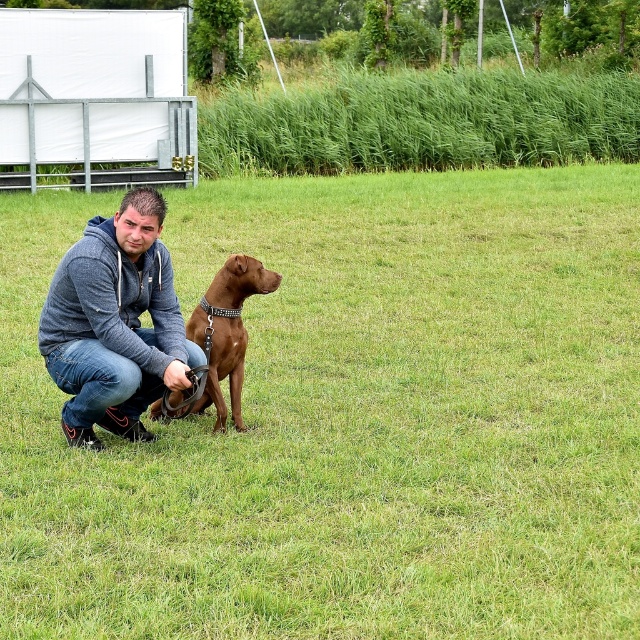
Is point (93, 401) more distant than point (83, 426)?

No, (93, 401) is closer to viewer.

What do you see at coordinates (115, 323) in the screenshot?
I see `gray hoodie at lower left` at bounding box center [115, 323].

At what (x,y) coordinates should I click in order to perform the action: click on gray hoodie at lower left. Please return your answer as a coordinate pair (x, y). Image resolution: width=640 pixels, height=640 pixels. Looking at the image, I should click on (115, 323).

Does brown leather dog at center appear under gray hoodie at lower left?

Incorrect, brown leather dog at center is not positioned below gray hoodie at lower left.

Locate an element on the screen. brown leather dog at center is located at coordinates (349, 419).

Locate an element on the screen. This screenshot has height=640, width=640. brown leather dog at center is located at coordinates (349, 419).

Is gray hoodie at lower left in front of brown glossy dog at center?

Yes, it is.

Between gray hoodie at lower left and brown glossy dog at center, which one is positioned lower?

brown glossy dog at center is below.

Find the location of `gray hoodie at lower left`. gray hoodie at lower left is located at coordinates (115, 323).